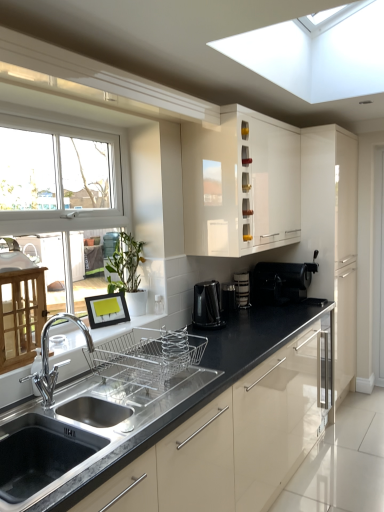
Question: Is black plastic coffee maker at center, which ranks as the 2th appliance in right-to-left order, in front of or behind black glossy coffee machine at center, which is the second coffee machine from back to front, in the image?

Choices:
 (A) front
 (B) behind

Answer: (B)

Question: Is black plastic coffee maker at center, acting as the first appliance starting from the left, inside the boundaries of black glossy coffee machine at center, which ranks as the 2th coffee machine in right-to-left order, or outside?

Choices:
 (A) outside
 (B) inside

Answer: (A)

Question: Which is nearer to the white glossy cabinet at upper center, the first cabinetry viewed from the left?

Choices:
 (A) glossy cream cabinet at right, which appears as the first cabinetry when viewed from the right
 (B) matte black coffee maker at center, marked as the 2th appliance in a left-to-right arrangement
 (C) black glossy coffee machine at center, which ranks as the 2th coffee machine in right-to-left order
 (D) chrome metallic faucet at lower left
 (E) black plastic coffee maker at center, acting as the first appliance starting from the left

Answer: (C)

Question: Estimate the real-world distances between objects in this image. Which object is closer to the stainless steel sink at lower left?

Choices:
 (A) glossy cream cabinet at right, the second cabinetry positioned from the left
 (B) green matte plant at center
 (C) white glossy cabinet at upper center, placed as the second cabinetry when sorted from right to left
 (D) matte black coffee maker at center, marked as the 2th appliance in a left-to-right arrangement
 (E) black plastic coffee machine at lower right, which ranks as the first coffee machine in back-to-front order

Answer: (B)